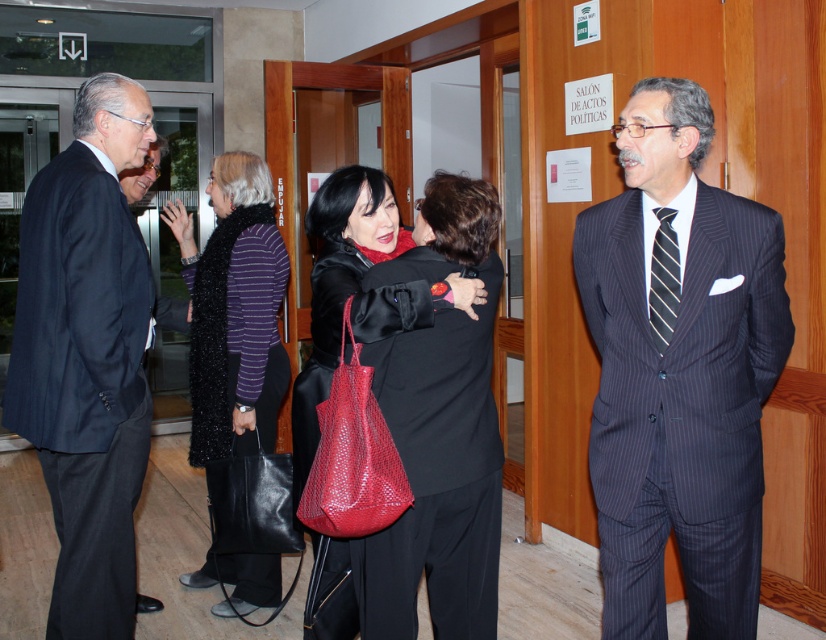
You are an event organizer and need to locate the dark blue suit at left in the image. Where exactly is it positioned?

The dark blue suit at left is located at point (x=88, y=355).

You are organizing a charity event and need to hang a 15 cm wide ribbon on the left side of the dark blue suit at left and the matte black coat at center. Which object requires a longer ribbon to cover its entire width?

The matte black coat at center requires a longer ribbon because it is wider than the dark blue suit at left.